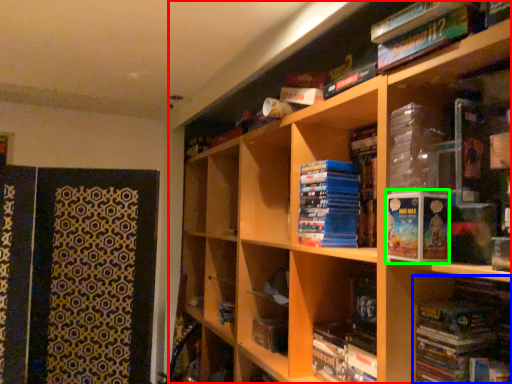
Question: Which object is positioned farthest from bookcase (highlighted by a red box)? Select from book (highlighted by a blue box) and paperback book (highlighted by a green box).

Choices:
 (A) book
 (B) paperback book

Answer: (B)